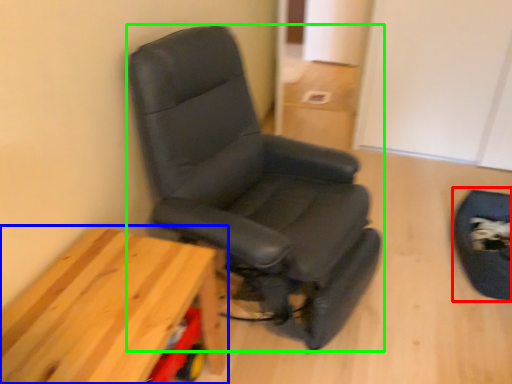
Question: Based on their relative distances, which object is nearer to swivel chair (highlighted by a red box)? Choose from table (highlighted by a blue box) and chair (highlighted by a green box).

Choices:
 (A) table
 (B) chair

Answer: (B)